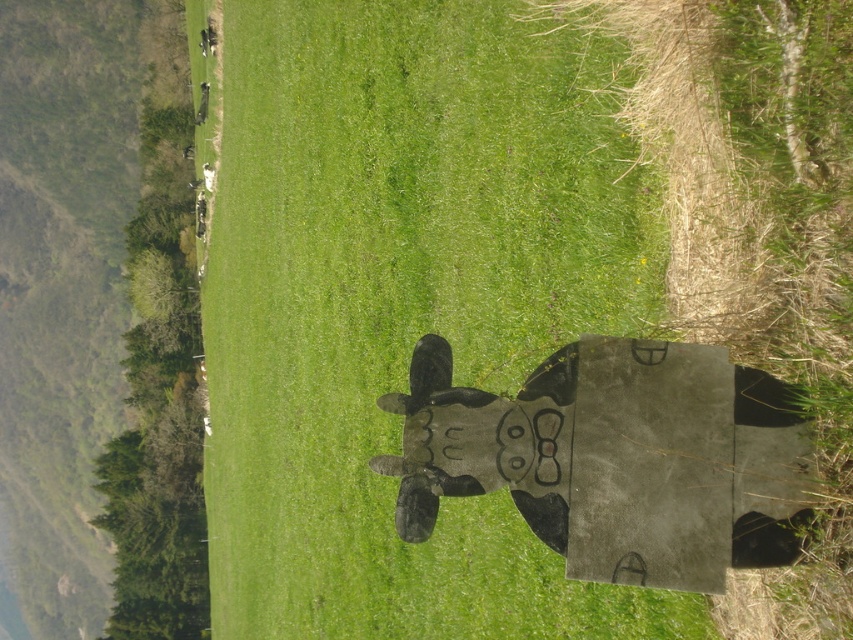
Who is positioned more to the left, wooden cow at center or black matte cow at center?

wooden cow at center is more to the left.

Describe the element at coordinates (407, 307) in the screenshot. I see `wooden cow at center` at that location.

Does point (306, 365) lie in front of point (776, 509)?

No, (306, 365) is behind (776, 509).

Image resolution: width=853 pixels, height=640 pixels. Identify the location of wooden cow at center. (407, 307).